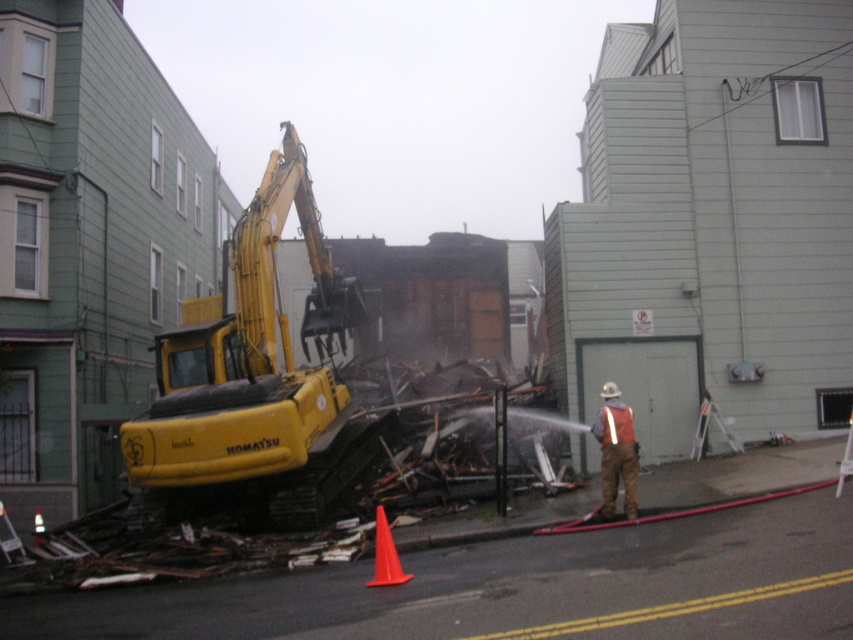
You are a safety inspector assessing the demolition site. You notice the yellow rubber excavator at left and the orange reflective vest at center. Which object is bigger in size?

The yellow rubber excavator at left is larger in size compared to the orange reflective vest at center.

You are a safety inspector observing the construction site. You notice the yellow rubber excavator at left and the orange reflective vest at center. According to safety protocols, the excavator should not be operating within 3 meters of any personnel. Can you determine if the excavator is violating this safety rule based on their positions?

The yellow rubber excavator at left is positioned over orange reflective vest at center, meaning it is directly above the worker. Since the excavator is operating directly over the worker, it is violating the safety rule of maintaining a 3 meter distance.